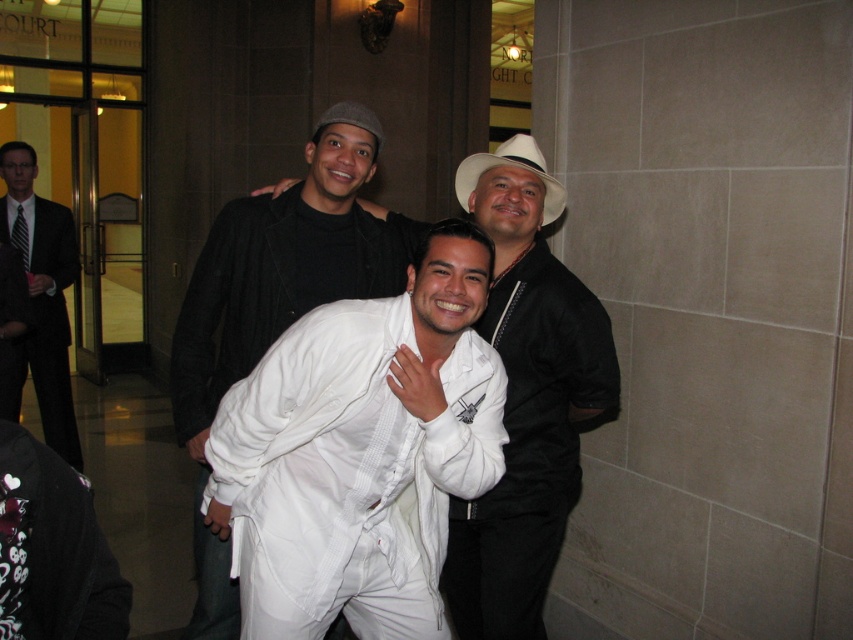
You are a photographer who needs to adjust the lighting for a group photo. You notice two white garments in the scene, the white satin shirt at center and the white matte robe at center. Which garment is located to the left of the other?

The white satin shirt at center is positioned on the left side of white matte robe at center.